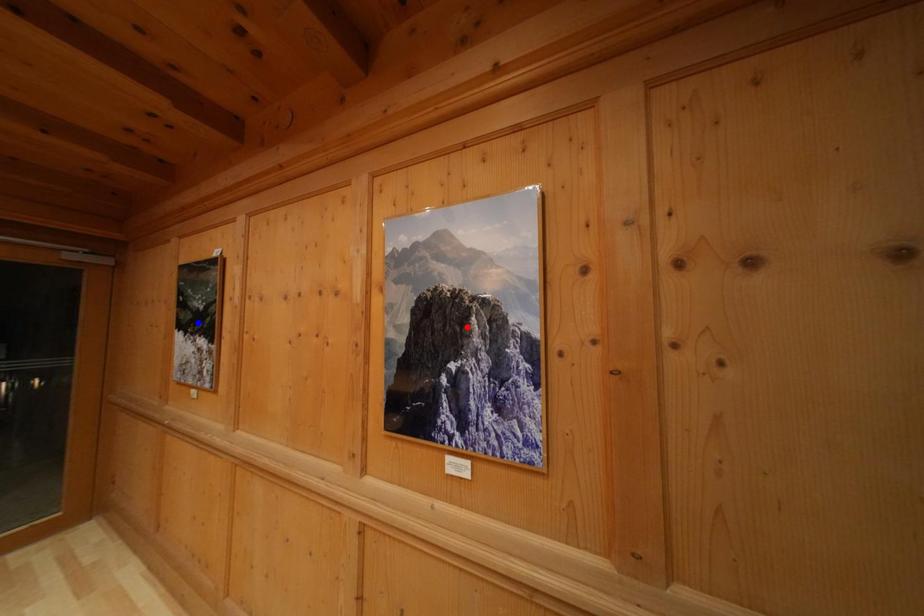
Question: Which of the two points in the image is closer to the camera?

Choices:
 (A) Blue point is closer.
 (B) Red point is closer.

Answer: (B)